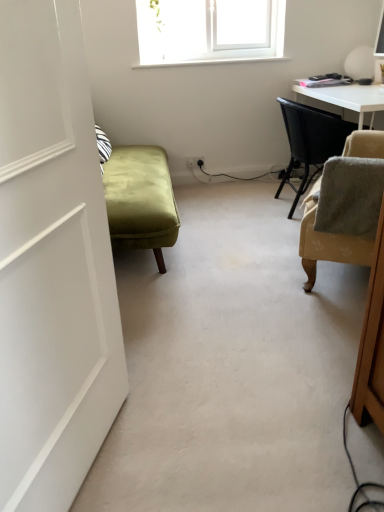
This screenshot has height=512, width=384. I want to click on vacant space underneath white matte door at left (from a real-world perspective), so click(105, 463).